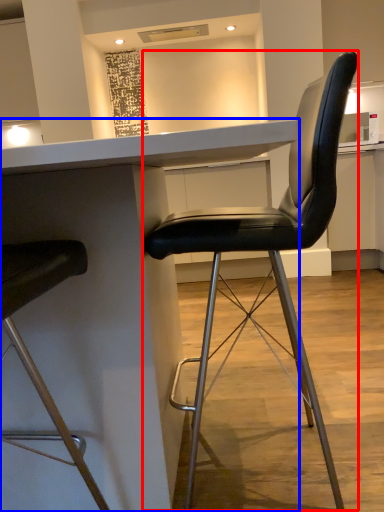
Question: Which point is further to the camera, chair (highlighted by a red box) or table (highlighted by a blue box)?

Choices:
 (A) chair
 (B) table

Answer: (A)